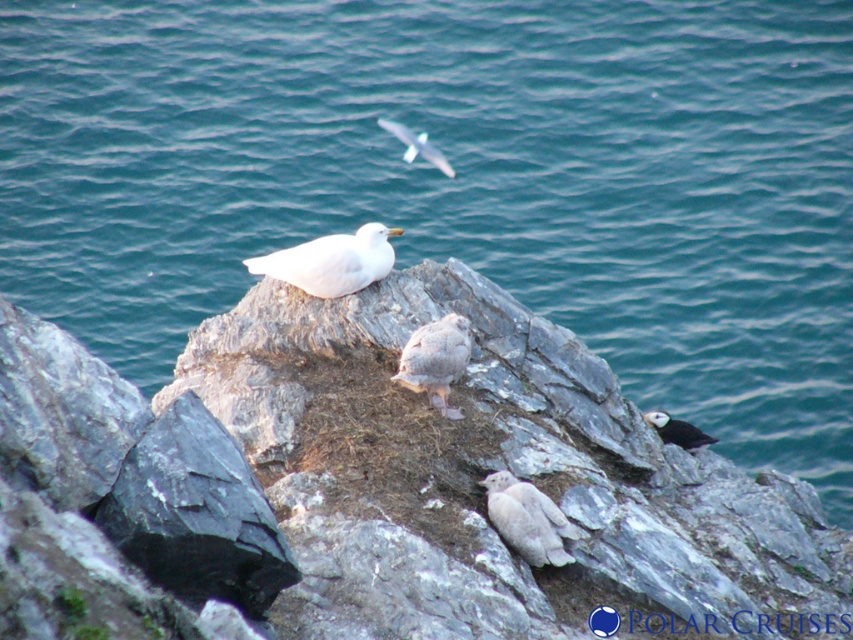
You are a photographer standing at the edge of the rocks wanting to take a photo of the gray rock at center and the white fluffy bird at lower center. If your camera can capture objects within a 16 inch range, will both subjects fit in the frame?

The gray rock at center and white fluffy bird at lower center are 15.30 inches apart, which is within the 16 inch range of the camera, so both subjects will fit in the frame.

You are a birdwatcher standing on the rocks and want to observe the white matte bird at upper center and the white fluffy bird at lower center. Which bird is closer to you?

The white matte bird at upper center is closer to you because it is further to the viewer than the white fluffy bird at lower center.